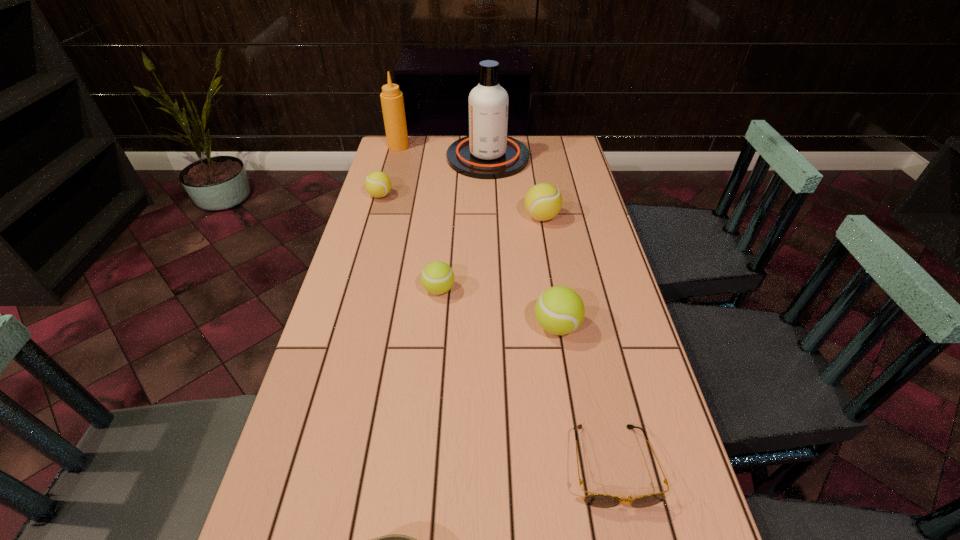
The width and height of the screenshot is (960, 540). Find the location of `the fourth nearest object`. the fourth nearest object is located at coordinates (437, 277).

Where is `the farther green tennis ball`? The width and height of the screenshot is (960, 540). the farther green tennis ball is located at coordinates (437, 277).

Locate an element on the screen. Image resolution: width=960 pixels, height=540 pixels. the shortest object is located at coordinates (596, 500).

You are a GUI agent. You are given a task and a screenshot of the screen. Output one action in this format:
    pyautogui.click(x=<x>, y=<y>)
    Task: Click on the sunglasses
    
    Given the screenshot: What is the action you would take?
    pyautogui.click(x=596, y=500)

Identify the location of free spot located on the front of the cleansing agent. (489, 200).

Locate an element on the screen. vacant point located 0.200m on the right of the condiment is located at coordinates (458, 146).

Where is `free space located on the left of the right yellow tennis ball`? The image size is (960, 540). free space located on the left of the right yellow tennis ball is located at coordinates (492, 217).

Find the location of a particular element. The height and width of the screenshot is (540, 960). vacant area located 0.060m on the front of the nearest tennis ball is located at coordinates (564, 366).

Locate an element on the screen. Image resolution: width=960 pixels, height=540 pixels. vacant space located on the right of the smaller yellow tennis ball is located at coordinates (444, 195).

Where is `vacant region located 0.200m on the right of the smaller green tennis ball`? vacant region located 0.200m on the right of the smaller green tennis ball is located at coordinates (528, 289).